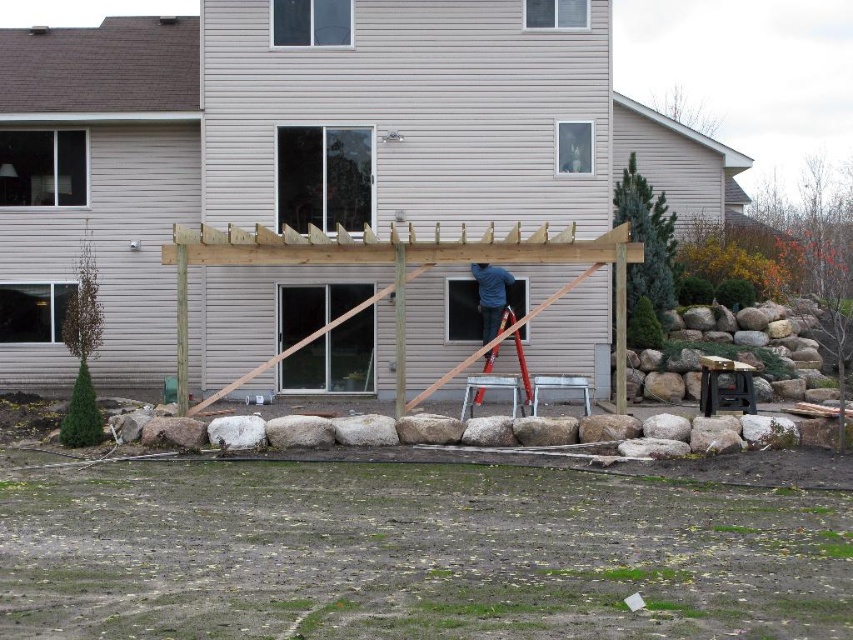
Measure the distance between dark blue shirt at center and camera.

dark blue shirt at center is 20.62 meters from camera.

Between point (486, 282) and point (519, 346), which one is positioned behind?

The point (486, 282) is more distant.

The image size is (853, 640). Identify the location of dark blue shirt at center. (490, 296).

Is natural wood pergola at center shorter than dark blue shirt at center?

In fact, natural wood pergola at center may be taller than dark blue shirt at center.

Does natural wood pergola at center have a smaller size compared to dark blue shirt at center?

Actually, natural wood pergola at center might be larger than dark blue shirt at center.

Describe the element at coordinates (305, 144) in the screenshot. I see `natural wood pergola at center` at that location.

In order to click on natural wood pergola at center in this screenshot , I will do `click(305, 144)`.

In the scene shown: Is natural wood pergola at center above metallic silver ladder at center?

Yes.

Which is in front, point (704, 212) or point (485, 358)?

Point (485, 358) is more forward.

Is point (416, 358) in front of point (488, 360)?

No, it is behind (488, 360).

At what (x,y) coordinates should I click in order to perform the action: click on natural wood pergola at center. Please return your answer as a coordinate pair (x, y). The width and height of the screenshot is (853, 640). Looking at the image, I should click on (305, 144).